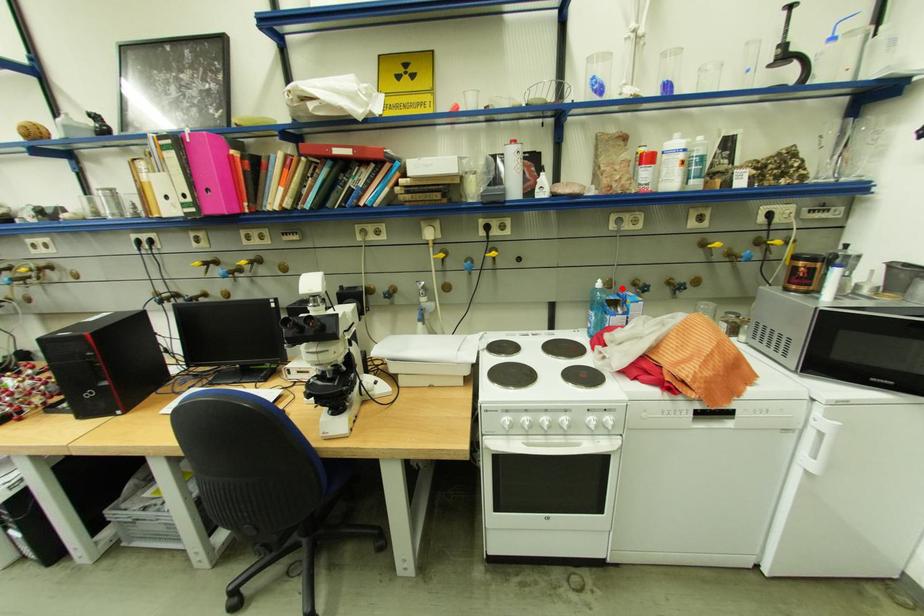
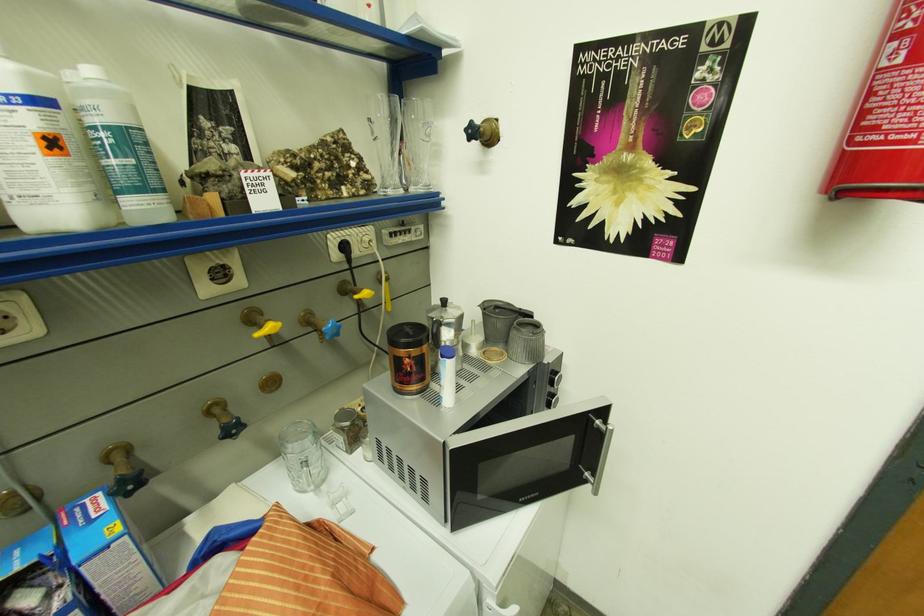
Locate, in the second image, the point that corresponds to the highlighted location in the first image.

(42, 509)